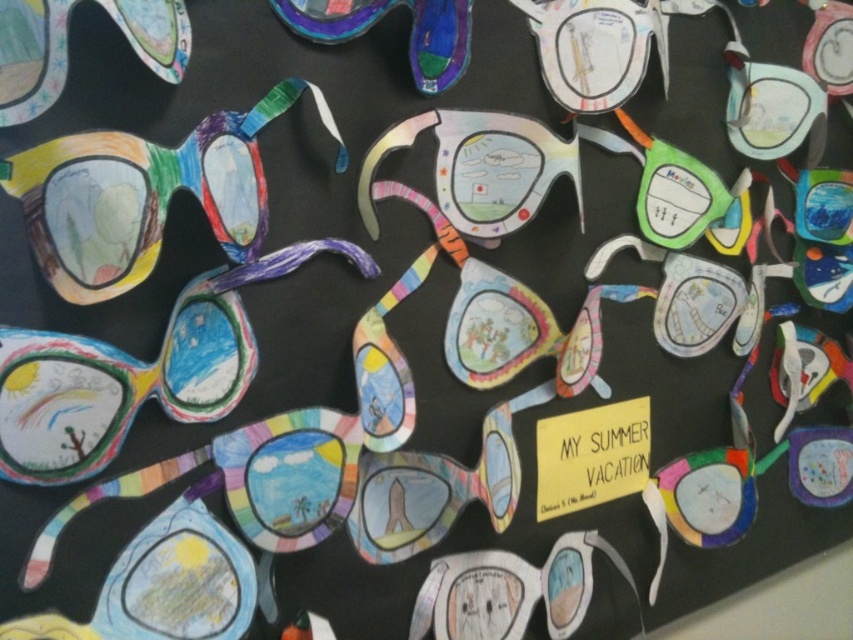
Is pastel rainbow sunglasses at center further to camera compared to matte green sunglasses at center?

No, pastel rainbow sunglasses at center is in front of matte green sunglasses at center.

Is point (514, 192) positioned in front of point (683, 202)?

Yes.

You are a GUI agent. You are given a task and a screenshot of the screen. Output one action in this format:
    pyautogui.click(x=<x>, y=<y>)
    Task: Click on the pastel rainbow sunglasses at center
    The height and width of the screenshot is (640, 853).
    Given the screenshot: What is the action you would take?
    pyautogui.click(x=480, y=168)

Can you confirm if matte multicolored goggles at left is positioned above matte paper goggles at center?

Correct, matte multicolored goggles at left is located above matte paper goggles at center.

Between point (119, 156) and point (468, 554), which one is positioned in front?

Positioned in front is point (119, 156).

Which is behind, point (71, 211) or point (517, 612)?

Point (517, 612)

I want to click on matte multicolored goggles at left, so click(144, 195).

Which is above, pastel rainbow sunglasses at center or matte paper goggles at center?

pastel rainbow sunglasses at center is higher up.

Is pastel rainbow sunglasses at center taller than matte paper goggles at center?

In fact, pastel rainbow sunglasses at center may be shorter than matte paper goggles at center.

You are a GUI agent. You are given a task and a screenshot of the screen. Output one action in this format:
    pyautogui.click(x=<x>, y=<y>)
    Task: Click on the pastel rainbow sunglasses at center
    The height and width of the screenshot is (640, 853).
    Given the screenshot: What is the action you would take?
    pyautogui.click(x=480, y=168)

At what (x,y) coordinates should I click in order to perform the action: click on pastel rainbow sunglasses at center. Please return your answer as a coordinate pair (x, y). Looking at the image, I should click on (480, 168).